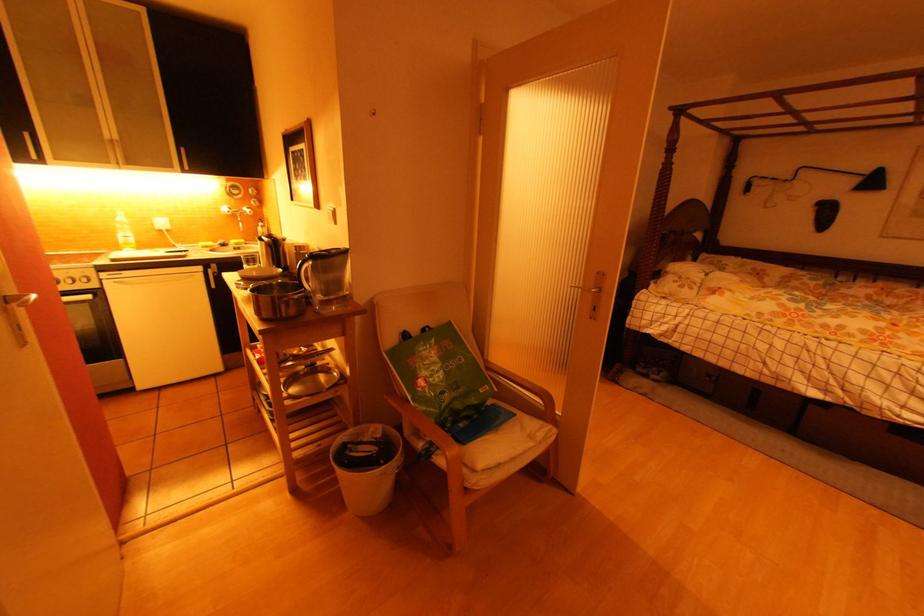
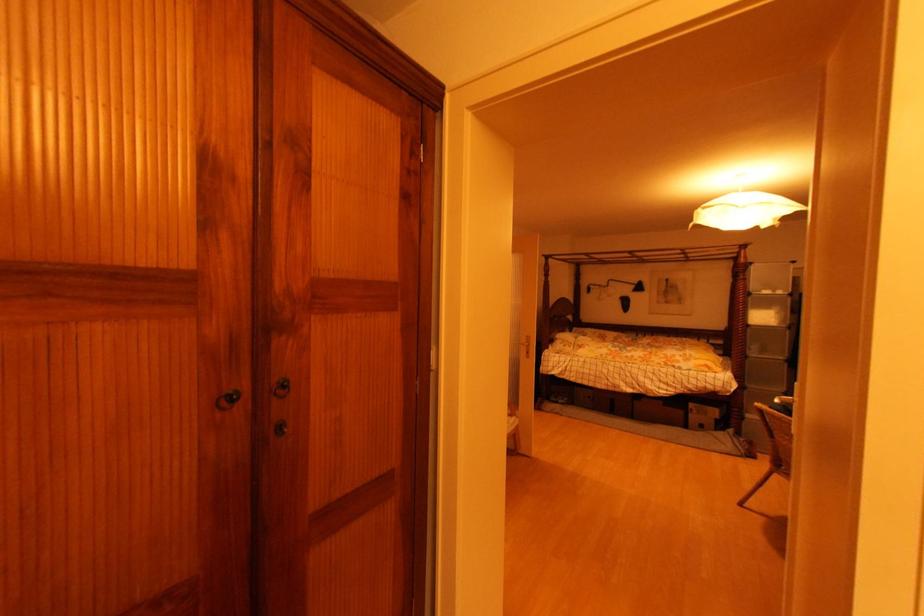
In a continuous first-person perspective shot, in which direction is the camera moving?

The movement direction of the cameraman is left, backward.